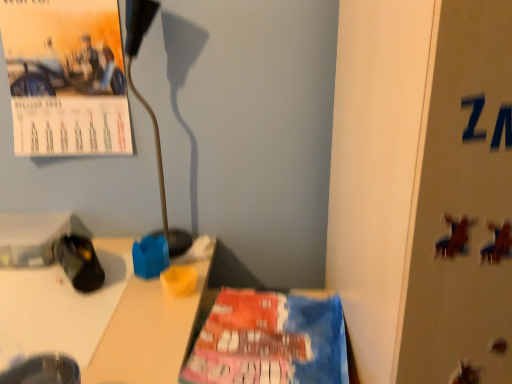
Identify the location of metallic gold lamp at upper left. This screenshot has width=512, height=384. (151, 108).

Describe the element at coordinates (79, 262) in the screenshot. I see `black fabric shoe at lower left` at that location.

What is the approximate height of matte paper calendar at upper left?

It is 16.01 inches.

This screenshot has width=512, height=384. Identify the location of metallic silver bulletin board at right. (462, 204).

Looking at this image, could you tell me if black fabric shoe at lower left is facing metallic silver bulletin board at right?

No, black fabric shoe at lower left is not facing towards metallic silver bulletin board at right.

Does point (90, 280) lie in front of point (426, 345)?

No, it is not.

Is black fabric shoe at lower left smaller than metallic silver bulletin board at right?

Yes, black fabric shoe at lower left is smaller than metallic silver bulletin board at right.

Is black fabric shoe at lower left thinner than metallic silver bulletin board at right?

Correct, the width of black fabric shoe at lower left is less than that of metallic silver bulletin board at right.

Between metallic gold lamp at upper left and matte paper calendar at upper left, which one appears on the right side from the viewer's perspective?

metallic gold lamp at upper left is more to the right.

Is metallic gold lamp at upper left in contact with matte paper calendar at upper left?

They are not placed beside each other.

Is metallic gold lamp at upper left facing away from matte paper calendar at upper left?

metallic gold lamp at upper left is not turned away from matte paper calendar at upper left.

From a real-world perspective, is metallic gold lamp at upper left positioned above or below matte paper calendar at upper left?

metallic gold lamp at upper left is situated lower than matte paper calendar at upper left in the real world.

From the image's perspective, is black fabric shoe at lower left positioned above or below metallic gold lamp at upper left?

black fabric shoe at lower left is below metallic gold lamp at upper left.

From a real-world perspective, which is physically below, black fabric shoe at lower left or metallic gold lamp at upper left?

In real-world perspective, black fabric shoe at lower left is lower.

Is black fabric shoe at lower left positioned beyond the bounds of metallic gold lamp at upper left?

black fabric shoe at lower left lies outside metallic gold lamp at upper left's area.

Consider the image. Are metallic silver bulletin board at right and black fabric shoe at lower left far apart?

No, metallic silver bulletin board at right is not far from black fabric shoe at lower left.

What's the angular difference between metallic silver bulletin board at right and black fabric shoe at lower left's facing directions?

The facing directions of metallic silver bulletin board at right and black fabric shoe at lower left are 57.2 degrees apart.

Locate an element on the screen. The width and height of the screenshot is (512, 384). bulletin board on the right of black fabric shoe at lower left is located at coordinates (462, 204).

Considering the relative sizes of metallic silver bulletin board at right and metallic gold lamp at upper left in the image provided, is metallic silver bulletin board at right thinner than metallic gold lamp at upper left?

Incorrect, the width of metallic silver bulletin board at right is not less than that of metallic gold lamp at upper left.

Which object is closer to the camera, metallic silver bulletin board at right or metallic gold lamp at upper left?

metallic silver bulletin board at right is more forward.

Is metallic silver bulletin board at right shorter than metallic gold lamp at upper left?

No.

From the image's perspective, is metallic silver bulletin board at right on metallic gold lamp at upper left?

No, from the image's perspective, metallic silver bulletin board at right is not on top of metallic gold lamp at upper left.

Looking at this image, can you confirm if metallic gold lamp at upper left is bigger than black fabric shoe at lower left?

Correct, metallic gold lamp at upper left is larger in size than black fabric shoe at lower left.

Is point (155, 124) behind point (97, 272)?

Yes, it is.

Does metallic gold lamp at upper left appear on the left side of black fabric shoe at lower left?

In fact, metallic gold lamp at upper left is to the right of black fabric shoe at lower left.

At what (x,y) coordinates should I click in order to perform the action: click on poster that appears behind the black fabric shoe at lower left. Please return your answer as a coordinate pair (x, y). This screenshot has height=384, width=512. Looking at the image, I should click on (66, 77).

In terms of width, does matte paper calendar at upper left look wider or thinner when compared to black fabric shoe at lower left?

matte paper calendar at upper left is thinner than black fabric shoe at lower left.

From a real-world perspective, who is located lower, matte paper calendar at upper left or black fabric shoe at lower left?

black fabric shoe at lower left is physically lower.

The image size is (512, 384). In order to click on bulletin board that is below the black fabric shoe at lower left (from the image's perspective) in this screenshot , I will do `click(462, 204)`.

The image size is (512, 384). What are the coordinates of `lamp on the right of matte paper calendar at upper left` in the screenshot? It's located at (151, 108).

Estimate the real-world distances between objects in this image. Which object is closer to metallic silver bulletin board at right, metallic gold lamp at upper left or matte paper calendar at upper left?

metallic gold lamp at upper left lies closer to metallic silver bulletin board at right than the other object.

Which object lies further to the anchor point black fabric shoe at lower left, metallic silver bulletin board at right or matte paper calendar at upper left?

Based on the image, metallic silver bulletin board at right appears to be further to black fabric shoe at lower left.

Estimate the real-world distances between objects in this image. Which object is further from black fabric shoe at lower left, metallic gold lamp at upper left or metallic silver bulletin board at right?

metallic silver bulletin board at right.

Which object lies nearer to the anchor point metallic silver bulletin board at right, matte paper calendar at upper left or metallic gold lamp at upper left?

metallic gold lamp at upper left lies closer to metallic silver bulletin board at right than the other object.

From the image, which object appears to be nearer to matte paper calendar at upper left, metallic gold lamp at upper left or black fabric shoe at lower left?

metallic gold lamp at upper left is closer to matte paper calendar at upper left.

Which object lies nearer to the anchor point matte paper calendar at upper left, metallic gold lamp at upper left or metallic silver bulletin board at right?

metallic gold lamp at upper left is positioned closer to the anchor matte paper calendar at upper left.

Which object lies nearer to the anchor point metallic gold lamp at upper left, black fabric shoe at lower left or metallic silver bulletin board at right?

black fabric shoe at lower left is positioned closer to the anchor metallic gold lamp at upper left.

Which object lies further to the anchor point metallic silver bulletin board at right, black fabric shoe at lower left or matte paper calendar at upper left?

matte paper calendar at upper left.

Where is `footwear between matte paper calendar at upper left and metallic silver bulletin board at right in the horizontal direction`? footwear between matte paper calendar at upper left and metallic silver bulletin board at right in the horizontal direction is located at coordinates (79, 262).

At what (x,y) coordinates should I click in order to perform the action: click on lamp between matte paper calendar at upper left and black fabric shoe at lower left vertically. Please return your answer as a coordinate pair (x, y). The width and height of the screenshot is (512, 384). Looking at the image, I should click on (151, 108).

At what (x,y) coordinates should I click in order to perform the action: click on lamp located between matte paper calendar at upper left and metallic silver bulletin board at right in the left-right direction. Please return your answer as a coordinate pair (x, y). Looking at the image, I should click on (151, 108).

You are a GUI agent. You are given a task and a screenshot of the screen. Output one action in this format:
    pyautogui.click(x=<x>, y=<y>)
    Task: Click on the lamp between black fabric shoe at lower left and metallic silver bulletin board at right in the horizontal direction
    The image size is (512, 384).
    Given the screenshot: What is the action you would take?
    pyautogui.click(x=151, y=108)